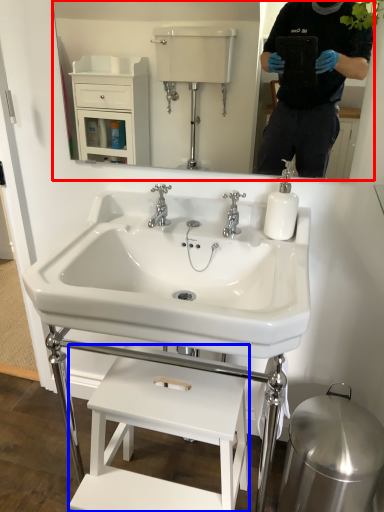
Question: Which object appears closest to the camera in this image, mirror (highlighted by a red box) or furniture (highlighted by a blue box)?

Choices:
 (A) mirror
 (B) furniture

Answer: (B)